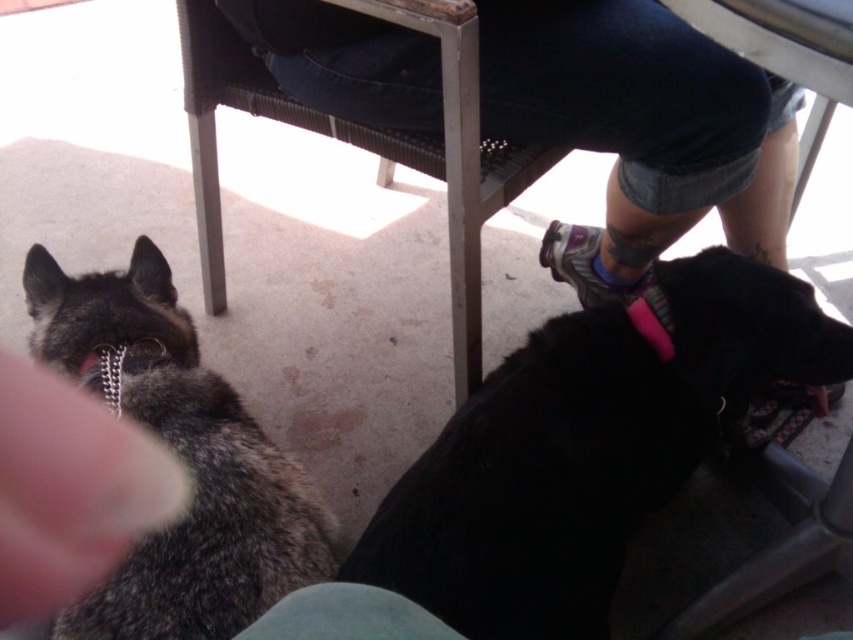
Is point (291, 504) closer to camera compared to point (201, 83)?

That is True.

Is point (277, 556) closer to viewer compared to point (469, 81)?

Yes, it is.

The width and height of the screenshot is (853, 640). Identify the location of gray fur dog at left. (178, 456).

Does jeans at lower right have a lesser width compared to metallic frame chair at upper center?

Incorrect, jeans at lower right's width is not less than metallic frame chair at upper center's.

Find the location of a particular element. jeans at lower right is located at coordinates (640, 129).

Find the location of `metallic frame chair at upper center`. metallic frame chair at upper center is located at coordinates (363, 145).

Does metallic frame chair at upper center have a larger size compared to fuzzy fur at lower left?

Yes, metallic frame chair at upper center is bigger than fuzzy fur at lower left.

Where is `metallic frame chair at upper center`? The image size is (853, 640). metallic frame chair at upper center is located at coordinates (363, 145).